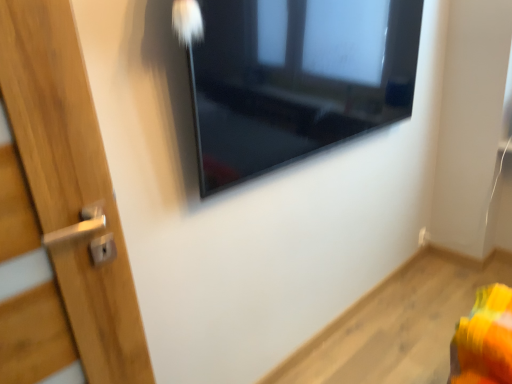
Locate an element on the screen. The height and width of the screenshot is (384, 512). free space below glossy glass window at upper center (from a real-world perspective) is located at coordinates (334, 344).